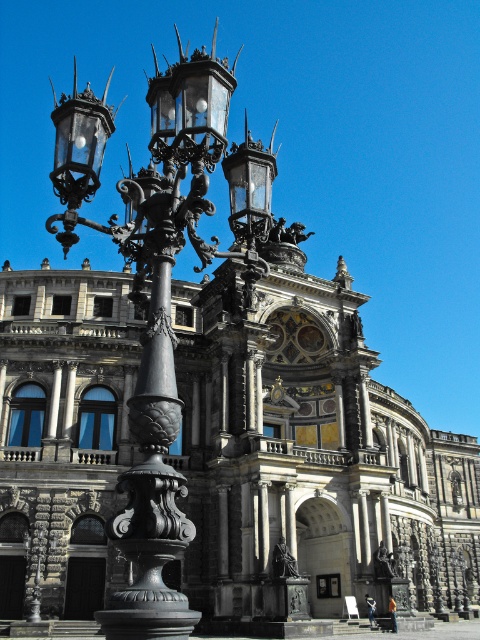
Looking at this image, can you confirm if dark gray stone palace at center is shorter than polished bronze street light at left?

Yes.

Between point (339, 305) and point (140, 268), which one is positioned in front?

Positioned in front is point (140, 268).

Measure the distance between point (337, 346) and camera.

A distance of 75.85 meters exists between point (337, 346) and camera.

Locate an element on the screen. dark gray stone palace at center is located at coordinates (311, 458).